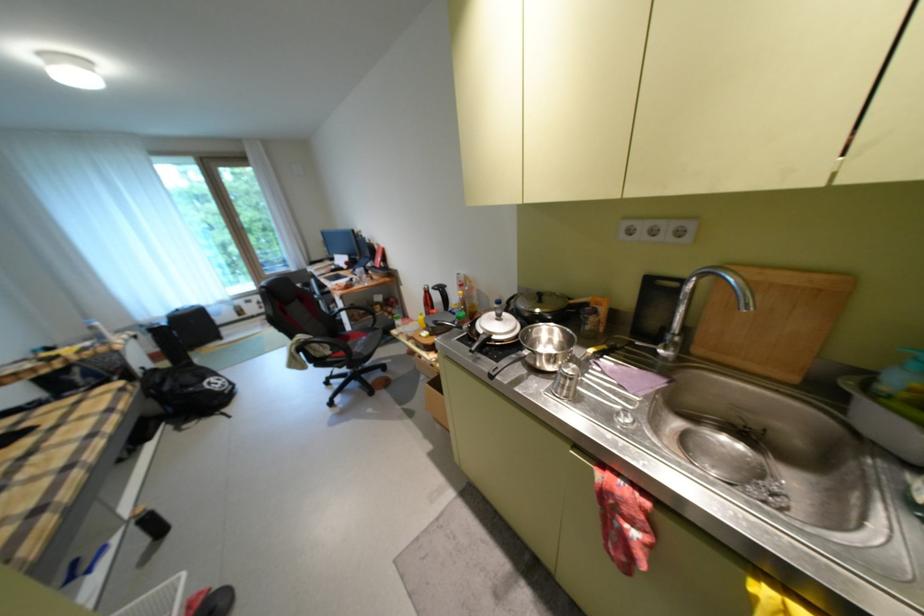
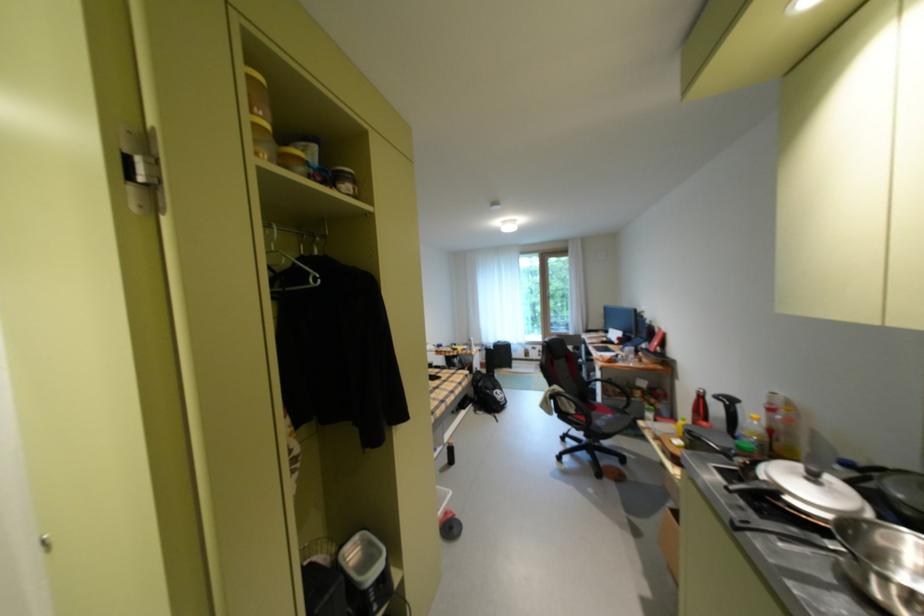
Find the pixel in the second image that matches (x=497, y=350) in the first image.

(775, 507)